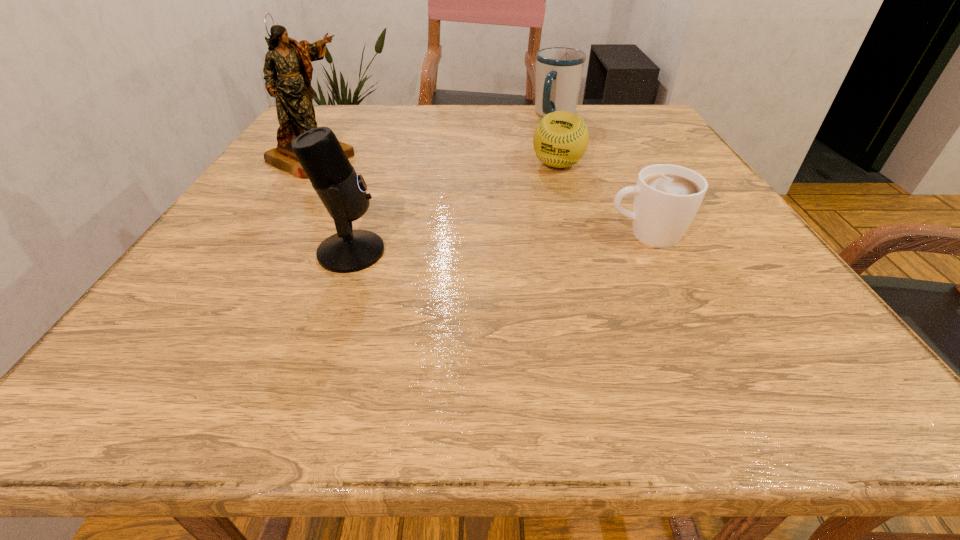
Where is `vacant space at the far left corner of the desktop`? vacant space at the far left corner of the desktop is located at coordinates (322, 115).

In order to click on vacant space at the near left corner of the desktop in this screenshot , I will do `click(170, 305)`.

Identify the location of vacant point located between the cappuccino and the microphone. (499, 243).

Locate an element on the screen. This screenshot has width=960, height=540. free point between the microphone and the farthest object is located at coordinates (453, 184).

What are the coordinates of `free space that is in between the cappuccino and the mug` in the screenshot? It's located at (601, 174).

The image size is (960, 540). Identify the location of free spot between the cappuccino and the softball. (602, 200).

Locate an element on the screen. The height and width of the screenshot is (540, 960). vacant region between the third shortest object and the cappuccino is located at coordinates (601, 174).

Find the location of a particular element. blank region between the cappuccino and the fourth shortest object is located at coordinates (499, 243).

In order to click on empty space that is in between the cappuccino and the third shortest object in this screenshot , I will do `click(601, 174)`.

Choose which object is the fourth nearest neighbor to the cappuccino. Please provide its 2D coordinates. Your answer should be formatted as a tuple, i.e. [(x, y)], where the tuple contains the x and y coordinates of a point satisfying the conditions above.

[(291, 87)]